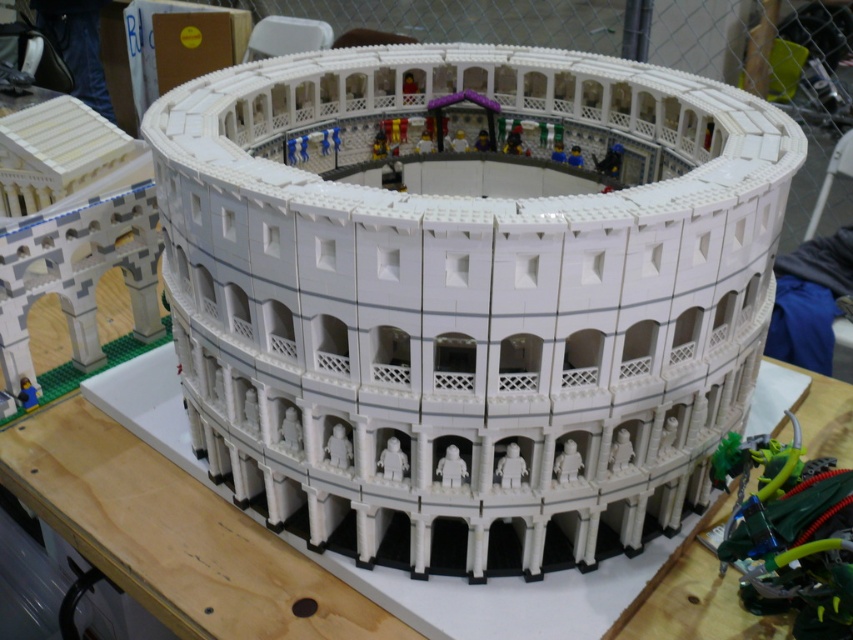
Does point (567, 364) come farther from viewer compared to point (311, 566)?

No, (567, 364) is closer to viewer.

Can you confirm if white lego colosseum at center is positioned below wooden table at center?

No.

Between point (610, 193) and point (332, 596), which one is positioned in front?

Point (610, 193) is more forward.

Identify the location of white lego colosseum at center. Image resolution: width=853 pixels, height=640 pixels. (466, 296).